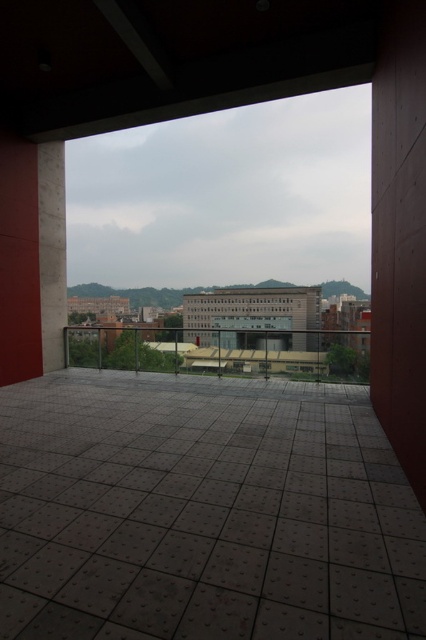
Question: Is brown wood pillar at right bigger than concrete pillar at left?

Choices:
 (A) yes
 (B) no

Answer: (B)

Question: Does brown wood pillar at right have a larger size compared to concrete pillar at left?

Choices:
 (A) no
 (B) yes

Answer: (A)

Question: From the image, what is the correct spatial relationship of brown wood pillar at right in relation to concrete pillar at left?

Choices:
 (A) above
 (B) below

Answer: (B)